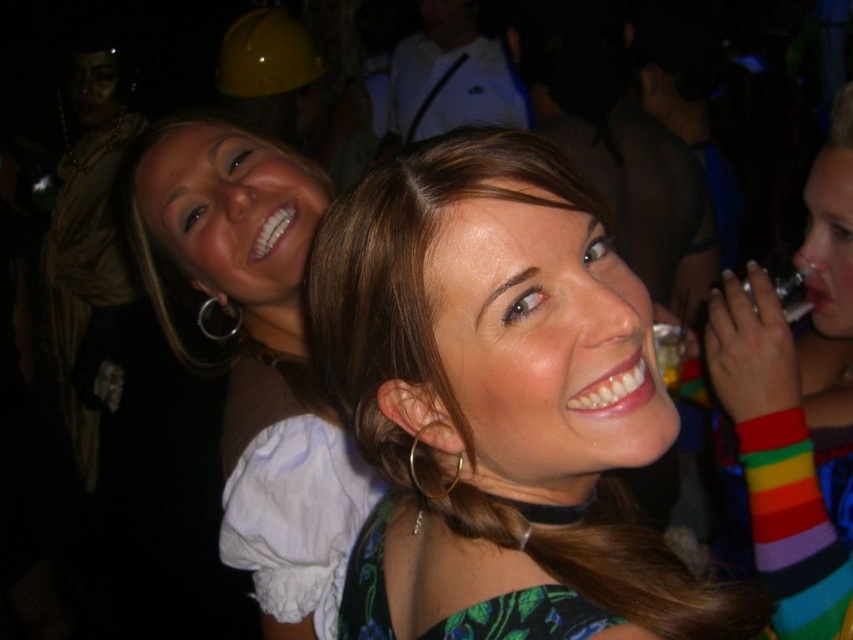
Consider the image. You are a photographer at the party and want to capture both the matte brown hair at center and the rainbow striped wristband at right in a single closeup shot. Which object should you focus on first to ensure both are in frame?

The matte brown hair at center has a larger size compared to rainbow striped wristband at right, so you should focus on the matte brown hair at center first to ensure both are in frame.

You are at a party and want to find the matte green dress at center. Where should you look relative to the matte brown hair at center?

The matte green dress at center is located below the matte brown hair at center.